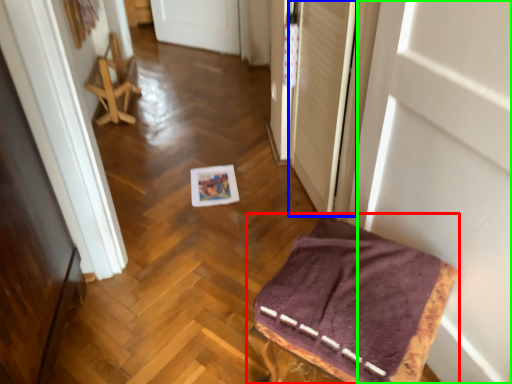
Question: Based on their relative distances, which object is nearer to furniture (highlighted by a red box)? Choose from screen door (highlighted by a blue box) and door (highlighted by a green box).

Choices:
 (A) screen door
 (B) door

Answer: (B)